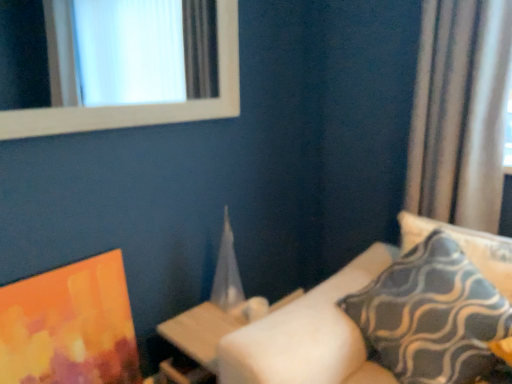
This screenshot has width=512, height=384. Find the location of `free point above wooden table at center (from a real-world perspective)`. free point above wooden table at center (from a real-world perspective) is located at coordinates (212, 324).